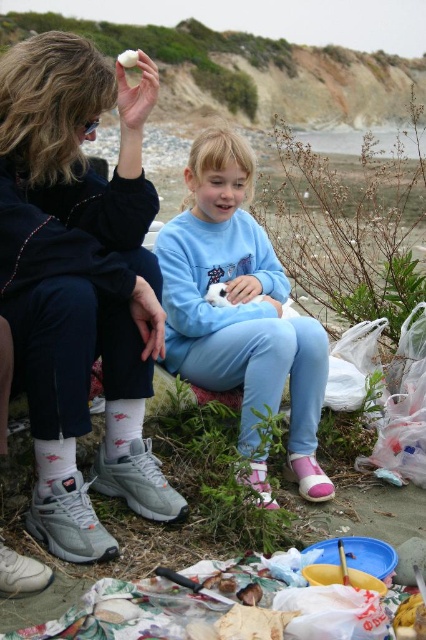
Consider the image. You are a photographer setting up a tripod between the matte black sneakers at left and the white cotton sock at lower left. The tripod requires a minimum distance of 30 cm between its legs to avoid tipping. Given the spatial relationship between these two objects, can you safely place the tripod here?

The matte black sneakers at left is wider than the white cotton sock at lower left, so the distance between them may be sufficient for the tripod. However, without exact measurements, it is uncertain if the 30 cm requirement is met. Check the actual spacing before placing the tripod.

You are a photographer trying to capture a closeup of the light blue fleece sweatshirt at center. According to the coordinates provided, where should you position your camera to ensure the sweatshirt is centered in your shot?

To center the light blue fleece sweatshirt at center in your shot, position your camera at the coordinates point (239, 307) as specified.